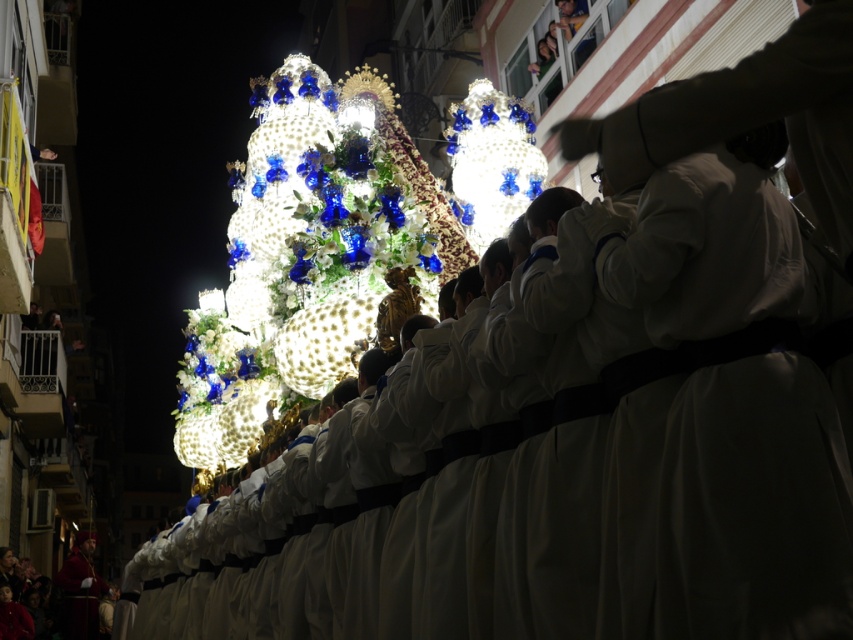
Question: Is white matte robe at center to the left of iridescent glass ornament at center from the viewer's perspective?

Choices:
 (A) no
 (B) yes

Answer: (A)

Question: Which point appears closest to the camera in this image?

Choices:
 (A) (364, 268)
 (B) (824, 570)
 (C) (468, 214)
 (D) (78, 554)

Answer: (B)

Question: Estimate the real-world distances between objects in this image. Which object is farther from the iridescent glass ornament at center?

Choices:
 (A) white matte robe at center
 (B) illuminated glass christmas tree at center
 (C) velvet red robe at lower left

Answer: (C)

Question: Which point is closer to the camera?

Choices:
 (A) iridescent glass ornament at center
 (B) white matte robe at center
 (C) illuminated glass christmas tree at center
 (D) velvet red robe at lower left

Answer: (B)

Question: Does white matte robe at center have a greater width compared to illuminated glass christmas tree at center?

Choices:
 (A) yes
 (B) no

Answer: (B)

Question: Does white matte robe at center lie in front of illuminated glass christmas tree at center?

Choices:
 (A) no
 (B) yes

Answer: (B)